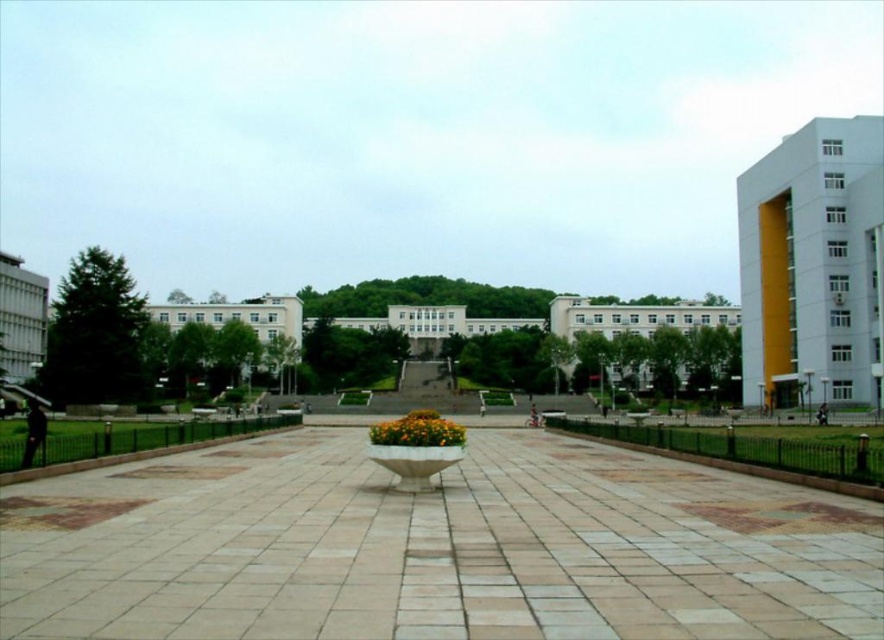
Question: Observing the image, what is the correct spatial positioning of white stone path at center in reference to yellow matte flower at center?

Choices:
 (A) right
 (B) left

Answer: (A)

Question: Which point is closer to the camera?

Choices:
 (A) (351, 500)
 (B) (378, 426)

Answer: (A)

Question: Is white stone path at center positioned before yellow matte flower at center?

Choices:
 (A) yes
 (B) no

Answer: (A)

Question: Which point is closer to the camera?

Choices:
 (A) (713, 515)
 (B) (379, 440)

Answer: (A)

Question: Among these points, which one is farthest from the camera?

Choices:
 (A) (1, 577)
 (B) (428, 440)

Answer: (B)

Question: Is white stone path at center above yellow matte flower at center?

Choices:
 (A) no
 (B) yes

Answer: (B)